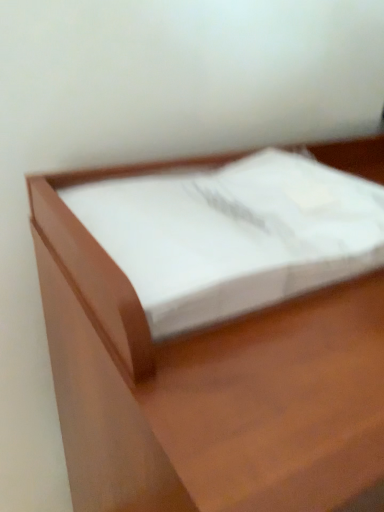
I want to click on matte wood tissue box at center, so click(x=205, y=384).

Image resolution: width=384 pixels, height=512 pixels. What do you see at coordinates (205, 384) in the screenshot? I see `matte wood tissue box at center` at bounding box center [205, 384].

This screenshot has height=512, width=384. In order to click on matte wood tissue box at center in this screenshot , I will do `click(205, 384)`.